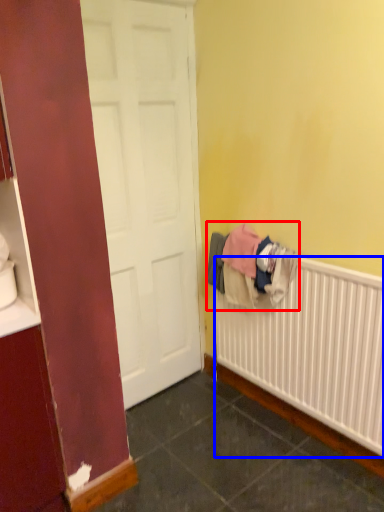
Question: Which point is further to the camera, clothing (highlighted by a red box) or radiator (highlighted by a blue box)?

Choices:
 (A) clothing
 (B) radiator

Answer: (A)